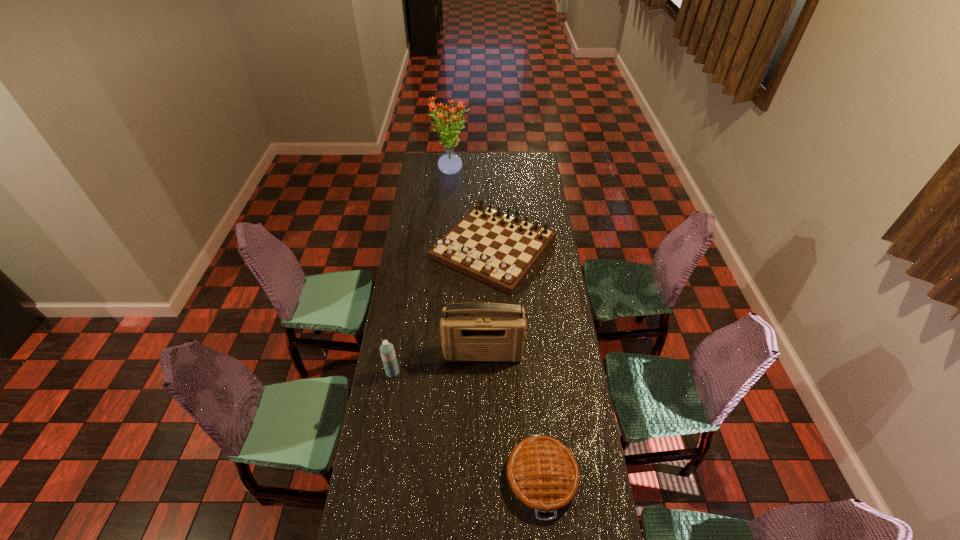
Locate an element on the screen. The width and height of the screenshot is (960, 540). flower arrangement is located at coordinates (449, 163).

Where is `the tallest object`? the tallest object is located at coordinates tap(449, 163).

This screenshot has width=960, height=540. I want to click on radio receiver, so click(471, 332).

You are a GUI agent. You are given a task and a screenshot of the screen. Output one action in this format:
    pyautogui.click(x=<x>, y=<y>)
    Task: Click on the second tallest object
    
    Given the screenshot: What is the action you would take?
    pyautogui.click(x=471, y=332)

Find the location of a particular element. The width and height of the screenshot is (960, 540). the second nearest object is located at coordinates (387, 351).

Find the location of a particular element. the leftmost object is located at coordinates (387, 351).

Find the location of a particular element. chessboard is located at coordinates (499, 249).

Image resolution: width=960 pixels, height=540 pixels. Find the location of `pie`. pie is located at coordinates (542, 472).

You are a GUI agent. You are given a task and a screenshot of the screen. Output one action in this format:
    pyautogui.click(x=<x>, y=<y>)
    Task: Click on the shortest object
    The height and width of the screenshot is (540, 960).
    Given the screenshot: What is the action you would take?
    pyautogui.click(x=542, y=472)

The width and height of the screenshot is (960, 540). I want to click on free space located on the right of the flower arrangement, so click(521, 173).